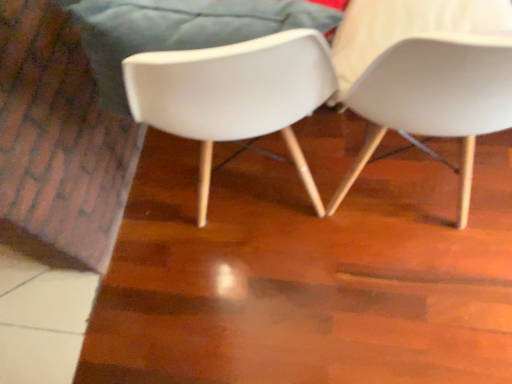
Locate an element on the screen. The image size is (512, 384). vacant area that lies in front of white matte chair at center, the 1th chair from the left is located at coordinates (295, 307).